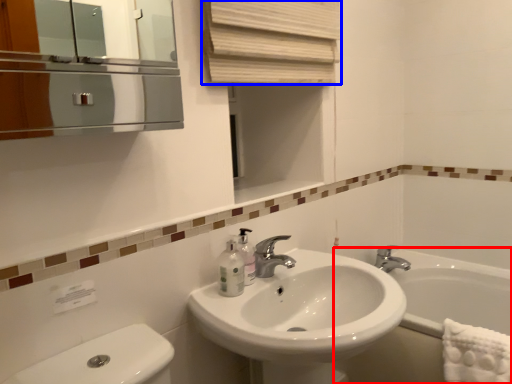
Question: Which object is further to the camera taking this photo, bath (highlighted by a red box) or curtain (highlighted by a blue box)?

Choices:
 (A) bath
 (B) curtain

Answer: (A)